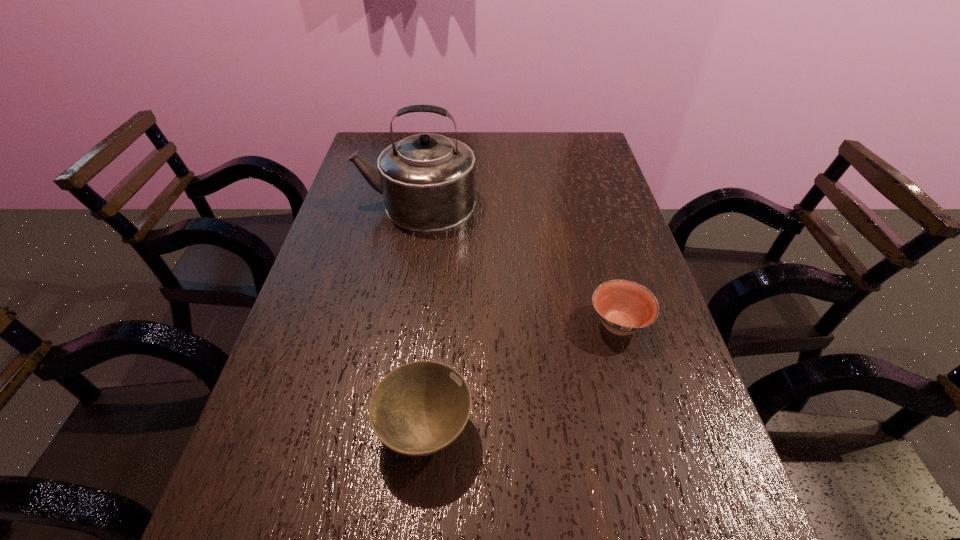
Find the location of a particular element. vacant region that satisfies the following two spatial constraints: 1. with the spout at the front of the kettle; 2. on the back side of the shortest object is located at coordinates (396, 324).

Where is `free spot that satisfies the following two spatial constraints: 1. with the spout at the front of the tallest object; 2. on the right side of the rightmost object`? Image resolution: width=960 pixels, height=540 pixels. free spot that satisfies the following two spatial constraints: 1. with the spout at the front of the tallest object; 2. on the right side of the rightmost object is located at coordinates (396, 324).

Where is `vacant area in the image that satisfies the following two spatial constraints: 1. with the spout at the front of the nearest object; 2. on the right side of the tallest object`? vacant area in the image that satisfies the following two spatial constraints: 1. with the spout at the front of the nearest object; 2. on the right side of the tallest object is located at coordinates (377, 429).

Identify the location of free spot that satisfies the following two spatial constraints: 1. with the spout at the front of the tallest object; 2. on the back side of the taller bowl. (377, 429).

I want to click on vacant space that satisfies the following two spatial constraints: 1. with the spout at the front of the shorter bowl; 2. on the left side of the farthest object, so click(396, 324).

Locate an element on the screen. The image size is (960, 540). vacant position in the image that satisfies the following two spatial constraints: 1. with the spout at the front of the shortest object; 2. on the right side of the kettle is located at coordinates (396, 324).

At what (x,y) coordinates should I click in order to perform the action: click on blank space that satisfies the following two spatial constraints: 1. with the spout at the front of the shortest object; 2. on the right side of the tallest object. Please return your answer as a coordinate pair (x, y). Image resolution: width=960 pixels, height=540 pixels. Looking at the image, I should click on (396, 324).

Locate an element on the screen. This screenshot has width=960, height=540. vacant space that satisfies the following two spatial constraints: 1. with the spout at the front of the left bowl; 2. on the right side of the tallest object is located at coordinates (377, 429).

Locate an element on the screen. Image resolution: width=960 pixels, height=540 pixels. vacant space that satisfies the following two spatial constraints: 1. with the spout at the front of the farthest object; 2. on the left side of the left bowl is located at coordinates (377, 429).